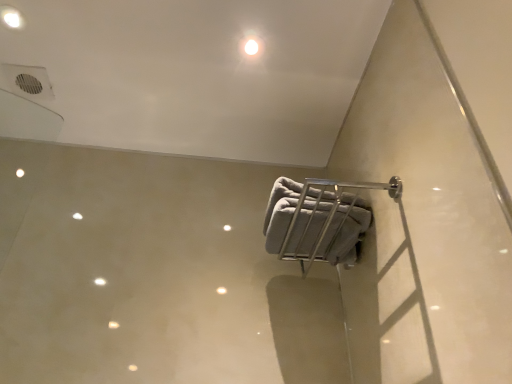
Question: In which direction should I rotate to look at white glossy light at upper center, which appears as the 1th dot when ordered from the bottom?

Choices:
 (A) left
 (B) right

Answer: (A)

Question: Is gray fabric towel at center-right not close to white glossy light fixture at upper left, the 2th dot positioned from the bottom?

Choices:
 (A) yes
 (B) no

Answer: (A)

Question: Considering the relative sizes of gray fabric towel at center-right and white glossy light fixture at upper left, the 2th dot positioned from the bottom, in the image provided, is gray fabric towel at center-right taller than white glossy light fixture at upper left, the 2th dot positioned from the bottom,?

Choices:
 (A) yes
 (B) no

Answer: (A)

Question: Is gray fabric towel at center-right smaller than white glossy light fixture at upper left, the 1th dot in the left-to-right sequence?

Choices:
 (A) yes
 (B) no

Answer: (B)

Question: Is gray fabric towel at center-right located outside white glossy light fixture at upper left, which is the first dot from top to bottom?

Choices:
 (A) no
 (B) yes

Answer: (B)

Question: Can you confirm if gray fabric towel at center-right is bigger than white glossy light fixture at upper left, the second dot in the right-to-left sequence?

Choices:
 (A) yes
 (B) no

Answer: (A)

Question: Is gray fabric towel at center-right wider than white glossy light fixture at upper left, the second dot in the right-to-left sequence?

Choices:
 (A) no
 (B) yes

Answer: (B)

Question: Is gray fabric towel at center-right facing towards white glossy light at upper center, which appears as the first dot when viewed from the right?

Choices:
 (A) yes
 (B) no

Answer: (B)

Question: Does gray fabric towel at center-right have a lesser height compared to white glossy light at upper center, which appears as the 1th dot when ordered from the bottom?

Choices:
 (A) yes
 (B) no

Answer: (B)

Question: From a real-world perspective, is gray fabric towel at center-right below white glossy light at upper center, which appears as the 1th dot when ordered from the bottom?

Choices:
 (A) no
 (B) yes

Answer: (B)

Question: Is white glossy light at upper center, which appears as the 1th dot when ordered from the bottom, a part of gray fabric towel at center-right?

Choices:
 (A) yes
 (B) no

Answer: (B)

Question: Is gray fabric towel at center-right oriented away from white glossy light at upper center, the 2th dot from the left?

Choices:
 (A) yes
 (B) no

Answer: (B)

Question: Does gray fabric towel at center-right have a lesser width compared to white glossy light at upper center, which appears as the first dot when viewed from the right?

Choices:
 (A) no
 (B) yes

Answer: (A)

Question: Is white glossy light at upper center, which appears as the 1th dot when ordered from the bottom, facing away from white glossy light fixture at upper left, which is the first dot from top to bottom?

Choices:
 (A) yes
 (B) no

Answer: (B)